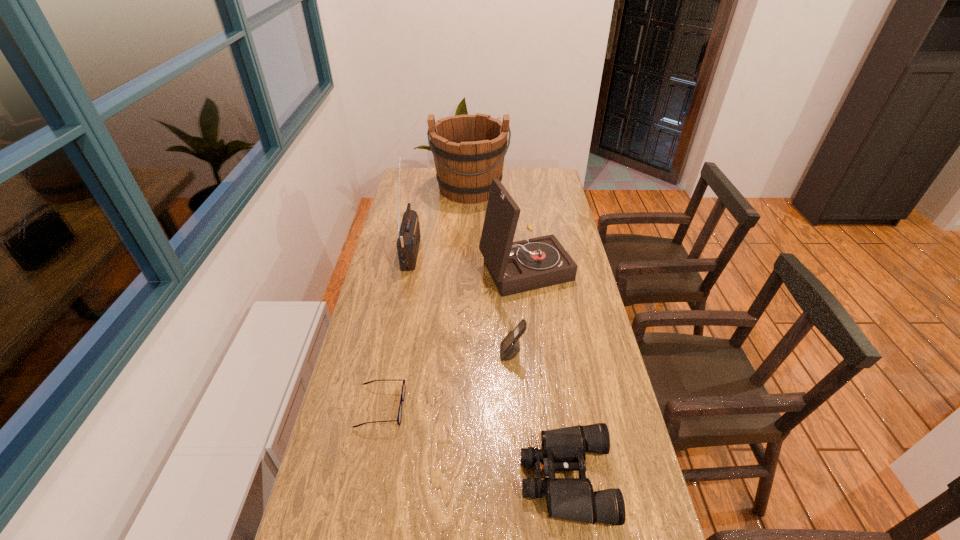
This screenshot has height=540, width=960. In order to click on wine bucket at the left edge in this screenshot , I will do `click(469, 150)`.

At what (x,y) coordinates should I click in order to perform the action: click on radio receiver that is positioned at the left edge. Please return your answer as a coordinate pair (x, y). Looking at the image, I should click on (408, 241).

Identify the location of spectacles located in the left edge section of the desktop. (x=399, y=417).

Where is `phonograph record positioned at the right edge`? This screenshot has height=540, width=960. phonograph record positioned at the right edge is located at coordinates (515, 267).

The image size is (960, 540). What are the coordinates of `binoculars present at the right edge` in the screenshot? It's located at (564, 449).

Find the location of a particular element. The width and height of the screenshot is (960, 540). object positioned at the far left corner is located at coordinates (469, 150).

What are the coordinates of `vacant position at the left edge of the desktop` in the screenshot? It's located at [381, 350].

Where is `free spot at the right edge of the desktop`? free spot at the right edge of the desktop is located at coordinates (603, 376).

At what (x,y) coordinates should I click in order to perform the action: click on vacant space at the far left corner of the desktop. Please return your answer as a coordinate pair (x, y). This screenshot has height=540, width=960. Looking at the image, I should click on (427, 172).

Find the location of a particular element. This screenshot has height=540, width=960. free space between the phonograph record and the second nearest object is located at coordinates (453, 336).